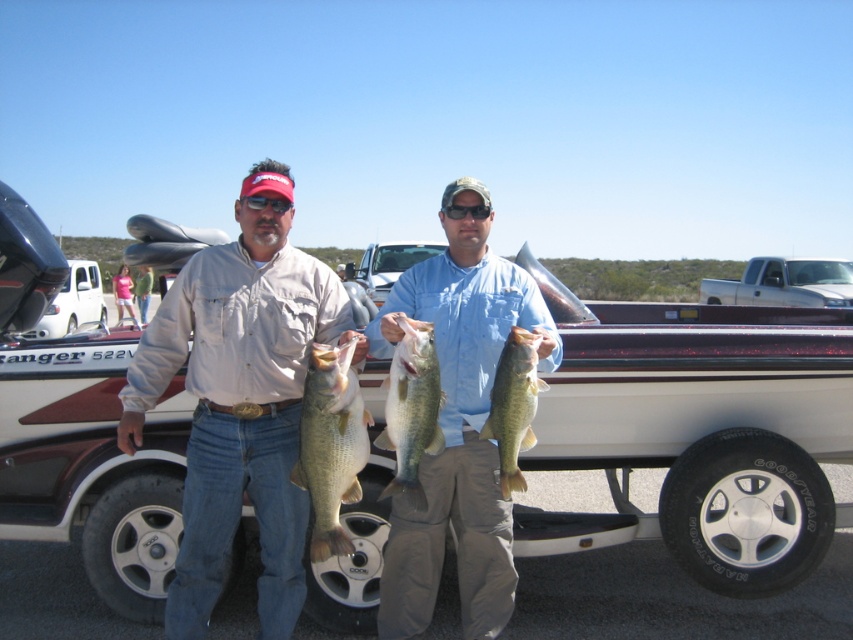
You are a photographer standing at the camera position. You want to place a 2.5 meter long banner between you and the white plastic boat at center. Will the banner fit in the space between you and the boat?

The distance between the camera and the white plastic boat at center is 3.73 meters. Since the banner is 2.5 meters long, it will fit in the space between you and the boat.